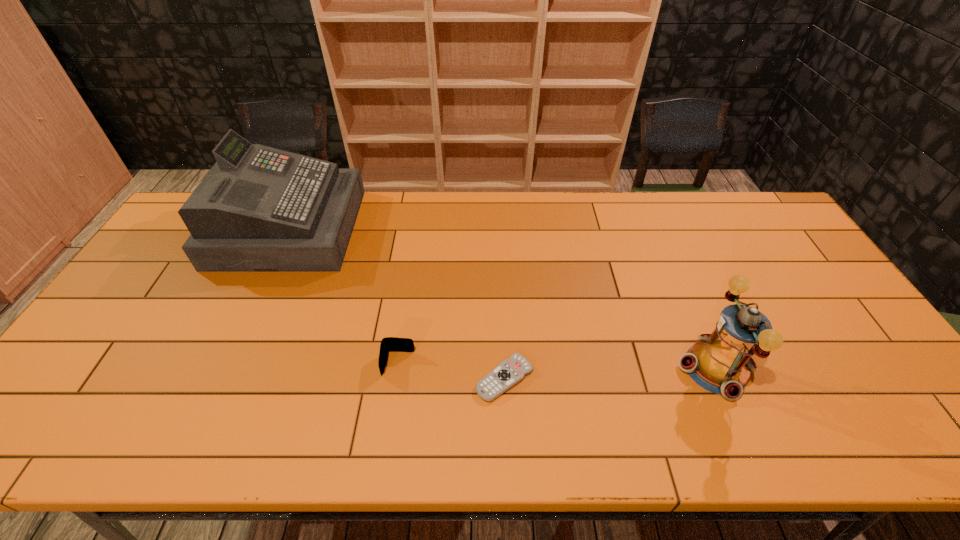
At what (x,y) coordinates should I click in order to perform the action: click on free space located on the front-facing side of the rightmost object. Please return your answer as a coordinate pair (x, y). Image resolution: width=960 pixels, height=540 pixels. Looking at the image, I should click on (601, 368).

Identify the location of free location located 0.160m on the outer surface of the third object from right to left. (386, 442).

Image resolution: width=960 pixels, height=540 pixels. What are the coordinates of `vacant area situated on the front of the second object from right to left` in the screenshot? It's located at (508, 450).

You are a GUI agent. You are given a task and a screenshot of the screen. Output one action in this format:
    pyautogui.click(x=<x>, y=<y>)
    Task: Click on the object that is positioned at the far edge
    Image resolution: width=960 pixels, height=540 pixels.
    Given the screenshot: What is the action you would take?
    pyautogui.click(x=259, y=209)

You are a GUI agent. You are given a task and a screenshot of the screen. Output one action in this format:
    pyautogui.click(x=<x>, y=<y>)
    Task: Click on the object located at the left edge
    
    Given the screenshot: What is the action you would take?
    pyautogui.click(x=259, y=209)

What are the coordinates of `object that is at the far left corner` in the screenshot? It's located at (259, 209).

Image resolution: width=960 pixels, height=540 pixels. In the image, there is a desktop. In order to click on vacant area at the far edge in this screenshot , I will do [x=612, y=197].

At what (x,y) coordinates should I click in order to perform the action: click on free space at the near edge. Please return your answer as a coordinate pair (x, y). The width and height of the screenshot is (960, 540). Looking at the image, I should click on (664, 418).

In the image, there is a desktop. Where is `vacant space at the left edge`? The height and width of the screenshot is (540, 960). vacant space at the left edge is located at coordinates (184, 259).

Identify the location of free region at the right edge of the desktop. This screenshot has height=540, width=960. (855, 355).